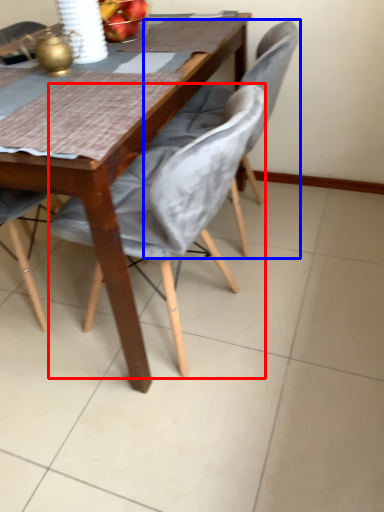
Question: Among these objects, which one is nearest to the camera, chair (highlighted by a red box) or chair (highlighted by a blue box)?

Choices:
 (A) chair
 (B) chair

Answer: (A)